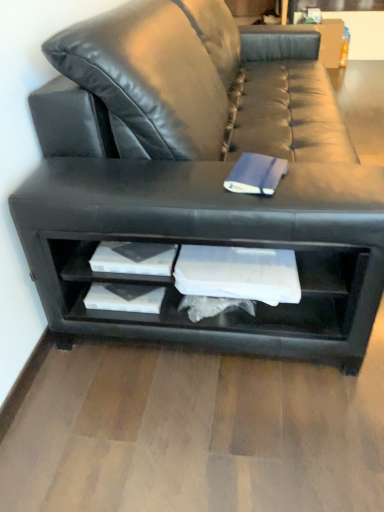
Question: Which is correct: black leather couch at center is inside blue matte paper at center, or outside of it?

Choices:
 (A) inside
 (B) outside

Answer: (B)

Question: From a real-world perspective, is black leather couch at center physically located above or below blue matte paper at center?

Choices:
 (A) below
 (B) above

Answer: (A)

Question: Considering the real-world distances, which object is closest to the blue matte paper at center?

Choices:
 (A) black leather shelf at lower center
 (B) black leather couch at center

Answer: (B)

Question: Based on their relative distances, which object is nearer to the blue matte paper at center?

Choices:
 (A) black leather couch at center
 (B) black leather shelf at lower center

Answer: (A)